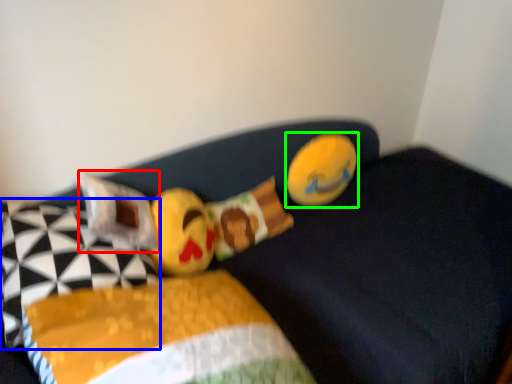
Question: Which is nearer to the pillow (highlighted by a red box)? pillow (highlighted by a blue box) or toy (highlighted by a green box).

Choices:
 (A) pillow
 (B) toy

Answer: (A)